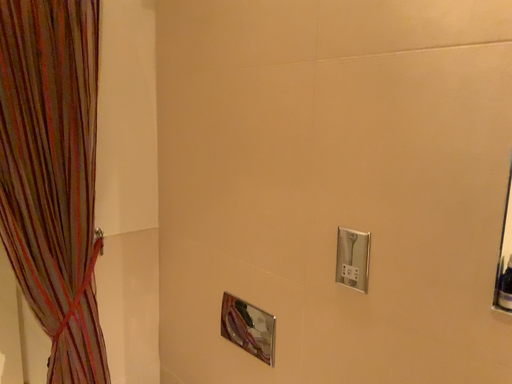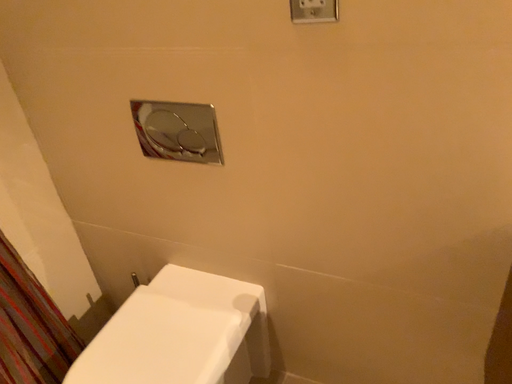
Question: Which way did the camera rotate in the video?

Choices:
 (A) rotated downward
 (B) rotated upward

Answer: (A)